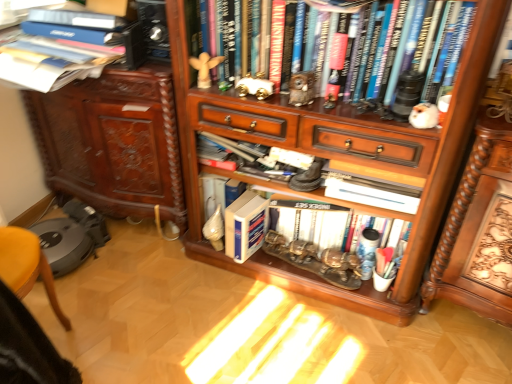
Question: Considering the relative positions of hardcover book at upper left, positioned as the first book in top-to-bottom order, and wooden carved desk at lower right in the image provided, is hardcover book at upper left, positioned as the first book in top-to-bottom order, to the left of wooden carved desk at lower right from the viewer's perspective?

Choices:
 (A) yes
 (B) no

Answer: (A)

Question: Is hardcover book at upper left, placed as the fourth book when sorted from bottom to top, shorter than wooden carved desk at lower right?

Choices:
 (A) yes
 (B) no

Answer: (A)

Question: Does hardcover book at upper left, positioned as the first book in top-to-bottom order, come in front of wooden carved desk at lower right?

Choices:
 (A) yes
 (B) no

Answer: (B)

Question: Considering the relative positions of hardcover book at upper left, positioned as the first book in top-to-bottom order, and wooden carved desk at lower right in the image provided, is hardcover book at upper left, positioned as the first book in top-to-bottom order, to the right of wooden carved desk at lower right from the viewer's perspective?

Choices:
 (A) yes
 (B) no

Answer: (B)

Question: From a real-world perspective, is hardcover book at upper left, positioned as the first book in top-to-bottom order, physically above wooden carved desk at lower right?

Choices:
 (A) no
 (B) yes

Answer: (B)

Question: Looking at their shapes, would you say wooden bookcase at center is wider or thinner than wooden cabinet at left?

Choices:
 (A) wide
 (B) thin

Answer: (A)

Question: Considering their positions, is wooden bookcase at center located in front of or behind wooden cabinet at left?

Choices:
 (A) behind
 (B) front

Answer: (B)

Question: From the image's perspective, is wooden bookcase at center above or below wooden cabinet at left?

Choices:
 (A) below
 (B) above

Answer: (A)

Question: From a real-world perspective, is wooden bookcase at center physically located above or below wooden cabinet at left?

Choices:
 (A) above
 (B) below

Answer: (A)

Question: Considering the positions of blue hardcover book at center, the fourth book from the top, and wooden carved desk at lower right in the image, is blue hardcover book at center, the fourth book from the top, wider or thinner than wooden carved desk at lower right?

Choices:
 (A) wide
 (B) thin

Answer: (B)

Question: From the image's perspective, is blue hardcover book at center, the fourth book from the top, positioned above or below wooden carved desk at lower right?

Choices:
 (A) below
 (B) above

Answer: (A)

Question: Based on their sizes in the image, would you say blue hardcover book at center, the 1th book from the bottom, is bigger or smaller than wooden carved desk at lower right?

Choices:
 (A) big
 (B) small

Answer: (B)

Question: Do you think blue hardcover book at center, the 1th book from the bottom, is within wooden carved desk at lower right, or outside of it?

Choices:
 (A) inside
 (B) outside

Answer: (B)

Question: From the image's perspective, is hardcover books at upper center, the second book positioned from the top, above or below white matte book at center, which is the third book in top-to-bottom order?

Choices:
 (A) above
 (B) below

Answer: (A)

Question: In the image, is hardcover books at upper center, the second book positioned from the top, on the left side or the right side of white matte book at center, which is the third book in top-to-bottom order?

Choices:
 (A) left
 (B) right

Answer: (B)